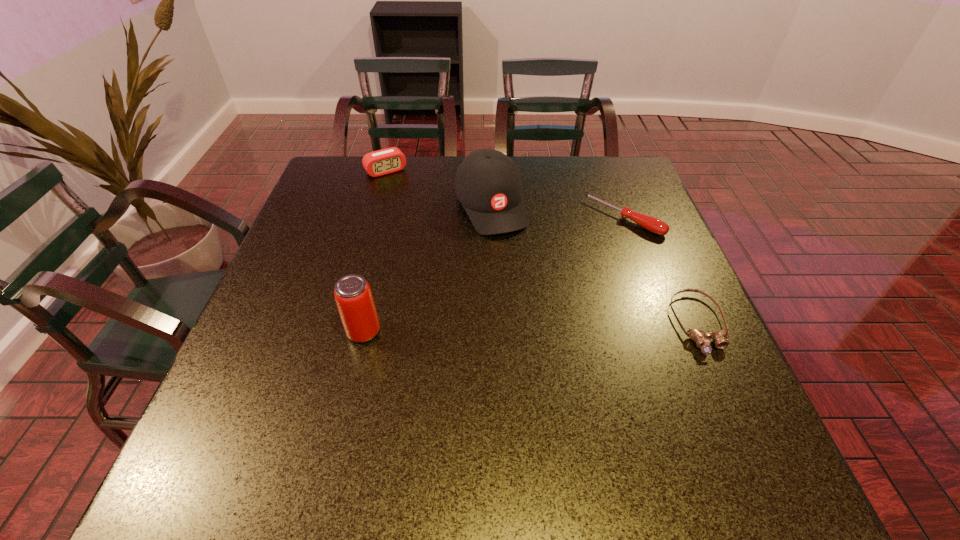
You are a GUI agent. You are given a task and a screenshot of the screen. Output one action in this format:
    pyautogui.click(x=<x>, y=<y>)
    Task: Click on the vacant space on the desktop that is between the beer can and the shortest object and is positioned with a logo on the front of the baseball cap
    
    Given the screenshot: What is the action you would take?
    pyautogui.click(x=551, y=327)

You are a GUI agent. You are given a task and a screenshot of the screen. Output one action in this format:
    pyautogui.click(x=<x>, y=<y>)
    Task: Click on the free space on the desktop that is between the beer can and the goggles and is positioned at the tip of the fourth tallest object
    
    Given the screenshot: What is the action you would take?
    pyautogui.click(x=501, y=328)

Identify the location of free space on the desktop that is between the beer can and the shortest object and is positioned on the front-facing side of the third shortest object. (498, 328).